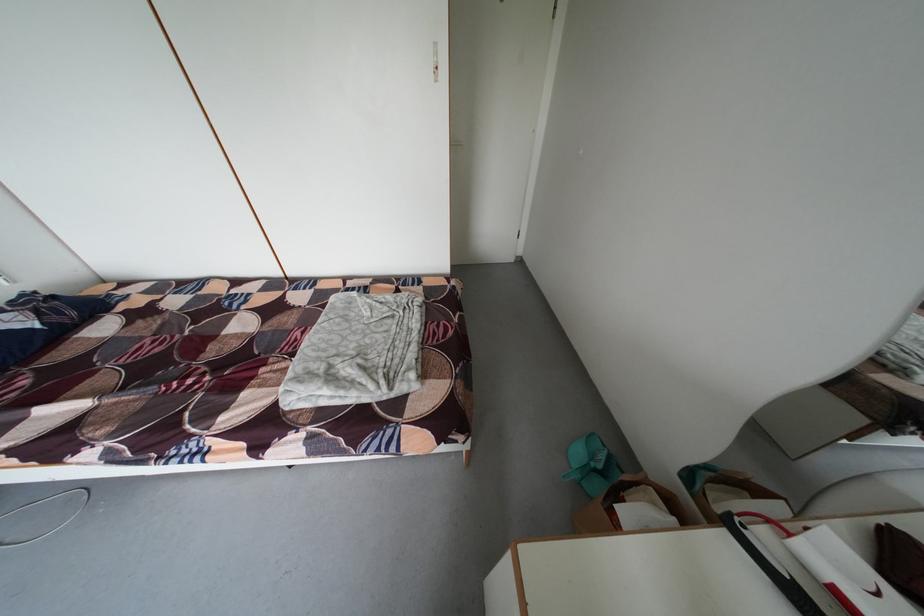
Find where to lift the brown leather pouch. Please return your answer as a coordinate pair (x, y).

(627, 506)